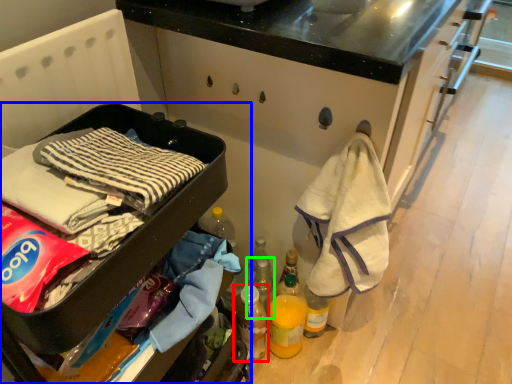
Question: Which object is positioned closest to bottle (highlighted by a red box)? Select from furniture (highlighted by a blue box) and bottle (highlighted by a green box).

Choices:
 (A) furniture
 (B) bottle

Answer: (B)